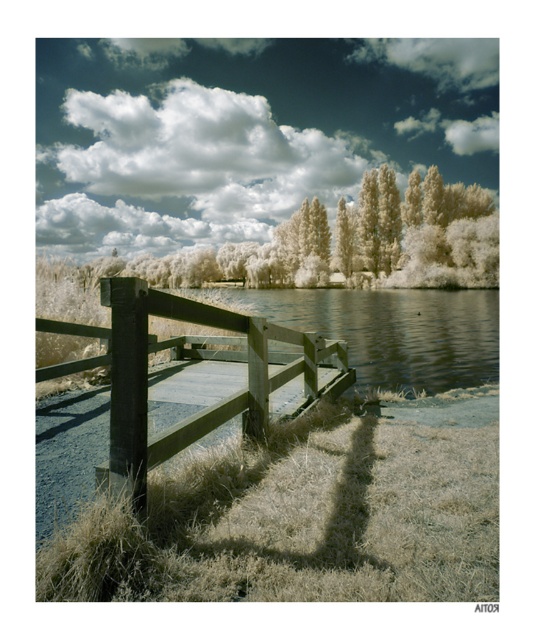
Does white fluffy cloud at upper center have a larger size compared to smooth gray water at center?

Indeed, white fluffy cloud at upper center has a larger size compared to smooth gray water at center.

Measure the distance between point (357,154) and camera.

149.21 meters

Does point (273, 216) come behind point (325, 330)?

That is True.

Locate an element on the screen. The image size is (535, 640). white fluffy cloud at upper center is located at coordinates coord(244,131).

Measure the distance from white fluffy trees at upper center to smooth gray water at center.

white fluffy trees at upper center is 20.15 meters away from smooth gray water at center.

This screenshot has height=640, width=535. What do you see at coordinates (353, 243) in the screenshot?
I see `white fluffy trees at upper center` at bounding box center [353, 243].

Find the location of a particular element. This screenshot has width=535, height=640. white fluffy trees at upper center is located at coordinates (353, 243).

Which is in front, point (173, 436) or point (210, 252)?

Point (173, 436) is in front.

Is point (121, 388) more distant than point (136, 269)?

That is False.

Where is `wooden fence at center`? wooden fence at center is located at coordinates (170, 392).

The width and height of the screenshot is (535, 640). What are the coordinates of `wooden fence at center` in the screenshot? It's located at [x=170, y=392].